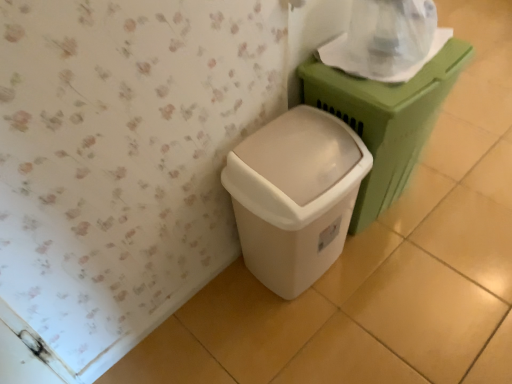
Question: Does white plastic waste container at lower center, arranged as the first waste container when viewed from the left, have a greater width compared to matte green plastic at right, the 2th waste container from the left?

Choices:
 (A) yes
 (B) no

Answer: (B)

Question: Could you tell me if white plastic waste container at lower center, the second waste container viewed from the right, is facing matte green plastic at right, positioned as the 1th waste container in right-to-left order?

Choices:
 (A) no
 (B) yes

Answer: (A)

Question: Is the position of white plastic waste container at lower center, arranged as the first waste container when viewed from the left, more distant than that of matte green plastic at right, the 2th waste container from the left?

Choices:
 (A) yes
 (B) no

Answer: (B)

Question: From a real-world perspective, is white plastic waste container at lower center, arranged as the first waste container when viewed from the left, below matte green plastic at right, positioned as the 1th waste container in right-to-left order?

Choices:
 (A) no
 (B) yes

Answer: (B)

Question: Is white plastic waste container at lower center, arranged as the first waste container when viewed from the left, taller than matte green plastic at right, the 2th waste container from the left?

Choices:
 (A) yes
 (B) no

Answer: (B)

Question: Is matte green plastic at right, the 2th waste container from the left, to the left or to the right of white plastic waste container at lower center, arranged as the first waste container when viewed from the left, in the image?

Choices:
 (A) left
 (B) right

Answer: (B)

Question: In terms of size, does matte green plastic at right, the 2th waste container from the left, appear bigger or smaller than white plastic waste container at lower center, the second waste container viewed from the right?

Choices:
 (A) small
 (B) big

Answer: (B)

Question: Is matte green plastic at right, the 2th waste container from the left, situated inside white plastic waste container at lower center, the second waste container viewed from the right, or outside?

Choices:
 (A) outside
 (B) inside

Answer: (A)

Question: Looking at their shapes, would you say matte green plastic at right, positioned as the 1th waste container in right-to-left order, is wider or thinner than white plastic waste container at lower center, the second waste container viewed from the right?

Choices:
 (A) thin
 (B) wide

Answer: (B)

Question: Looking at their shapes, would you say white plastic waste container at lower center, the second waste container viewed from the right, is wider or thinner than transparent plastic toilet paper at upper right?

Choices:
 (A) wide
 (B) thin

Answer: (A)

Question: From the image's perspective, is white plastic waste container at lower center, the second waste container viewed from the right, located above or below transparent plastic toilet paper at upper right?

Choices:
 (A) below
 (B) above

Answer: (A)

Question: In terms of height, does white plastic waste container at lower center, arranged as the first waste container when viewed from the left, look taller or shorter compared to transparent plastic toilet paper at upper right?

Choices:
 (A) short
 (B) tall

Answer: (B)

Question: Is point (295, 276) closer or farther from the camera than point (404, 54)?

Choices:
 (A) closer
 (B) farther

Answer: (B)

Question: From a real-world perspective, is transparent plastic toilet paper at upper right above or below matte green plastic at right, the 2th waste container from the left?

Choices:
 (A) above
 (B) below

Answer: (A)

Question: In terms of width, does transparent plastic toilet paper at upper right look wider or thinner when compared to matte green plastic at right, the 2th waste container from the left?

Choices:
 (A) wide
 (B) thin

Answer: (B)